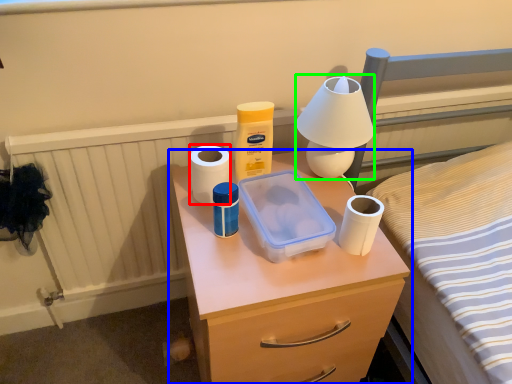
Question: Based on their relative distances, which object is nearer to toilet paper (highlighted by a red box)? Choose from chest of drawers (highlighted by a blue box) and table lamp (highlighted by a green box).

Choices:
 (A) chest of drawers
 (B) table lamp

Answer: (B)